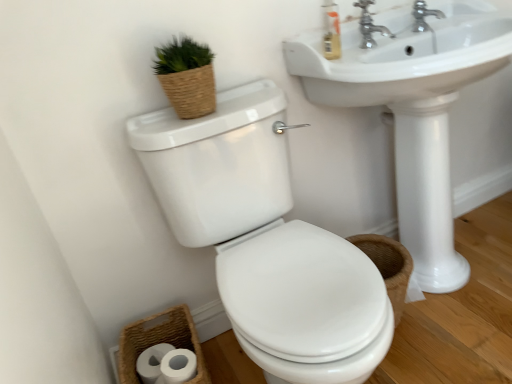
Question: Are white glossy sink at center and silver metallic faucet at upper right, which appears as the first tap when viewed from the right, far apart?

Choices:
 (A) yes
 (B) no

Answer: (B)

Question: Can we say white glossy sink at center lies outside silver metallic faucet at upper right, which appears as the first tap when viewed from the right?

Choices:
 (A) no
 (B) yes

Answer: (B)

Question: Is white glossy sink at center positioned with its back to silver metallic faucet at upper right, which appears as the first tap when viewed from the right?

Choices:
 (A) yes
 (B) no

Answer: (B)

Question: Does white glossy sink at center have a smaller size compared to silver metallic faucet at upper right, the second tap positioned from the left?

Choices:
 (A) no
 (B) yes

Answer: (A)

Question: Considering the relative positions of white glossy sink at center and silver metallic faucet at upper right, which appears as the first tap when viewed from the right, in the image provided, is white glossy sink at center in front of silver metallic faucet at upper right, which appears as the first tap when viewed from the right,?

Choices:
 (A) yes
 (B) no

Answer: (A)

Question: Is translucent plastic soap dispenser at upper right bigger or smaller than woven brown basket at lower left?

Choices:
 (A) big
 (B) small

Answer: (B)

Question: From a real-world perspective, is translucent plastic soap dispenser at upper right above or below woven brown basket at lower left?

Choices:
 (A) above
 (B) below

Answer: (A)

Question: Considering the positions of translucent plastic soap dispenser at upper right and woven brown basket at lower left in the image, is translucent plastic soap dispenser at upper right wider or thinner than woven brown basket at lower left?

Choices:
 (A) thin
 (B) wide

Answer: (A)

Question: Is translucent plastic soap dispenser at upper right inside the boundaries of woven brown basket at lower left, or outside?

Choices:
 (A) inside
 (B) outside

Answer: (B)

Question: Is satin nickel faucet at upper right, the 2th tap from the right, bigger or smaller than white matte toilet paper at lower left?

Choices:
 (A) small
 (B) big

Answer: (A)

Question: Is satin nickel faucet at upper right, the 2th tap from the right, to the left or to the right of white matte toilet paper at lower left in the image?

Choices:
 (A) left
 (B) right

Answer: (B)

Question: Considering the positions of satin nickel faucet at upper right, the first tap when ordered from left to right, and white matte toilet paper at lower left in the image, is satin nickel faucet at upper right, the first tap when ordered from left to right, taller or shorter than white matte toilet paper at lower left?

Choices:
 (A) tall
 (B) short

Answer: (B)

Question: From the image's perspective, is satin nickel faucet at upper right, the first tap when ordered from left to right, positioned above or below white matte toilet paper at lower left?

Choices:
 (A) above
 (B) below

Answer: (A)

Question: In terms of width, does woven brown basket at lower left look wider or thinner when compared to white glossy toilet at center?

Choices:
 (A) thin
 (B) wide

Answer: (A)

Question: From their relative heights in the image, would you say woven brown basket at lower left is taller or shorter than white glossy toilet at center?

Choices:
 (A) short
 (B) tall

Answer: (A)